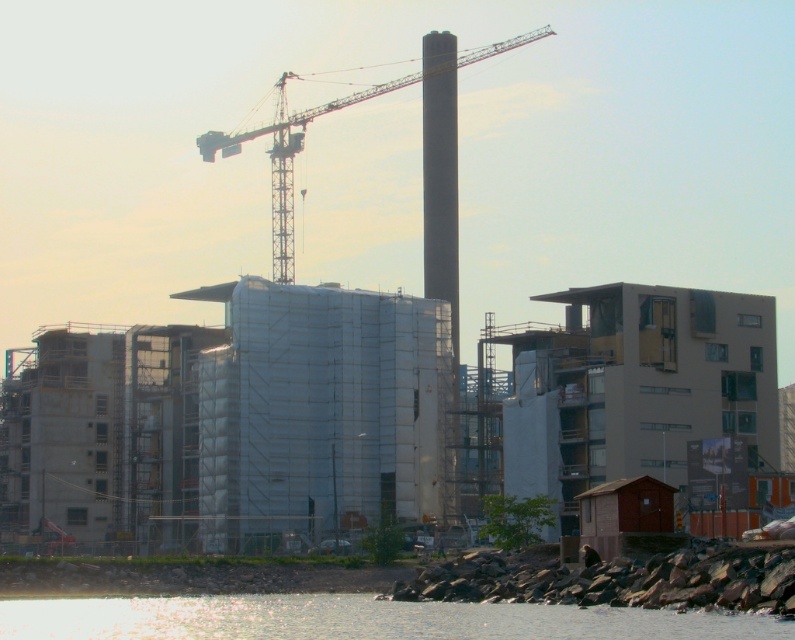
You are a construction worker who needs to move a heavy object from the metallic gray crane at upper center to the transparent water at lower left. Can you safely lower the object directly into the water without it hitting anything?

The transparent water at lower left is positioned under the metallic gray crane at upper center, so yes, the object can be safely lowered directly into the water without hitting anything.